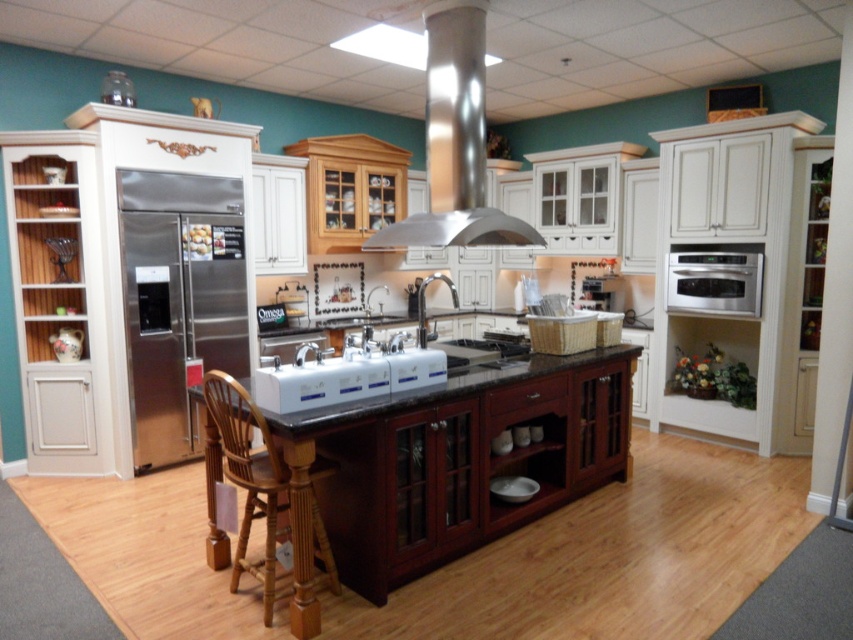
Based on the photo, which of these two, stainless steel refrigerator at left or stainless steel exhaust hood at center, stands taller?

stainless steel refrigerator at left

Does stainless steel refrigerator at left appear on the right side of stainless steel exhaust hood at center?

No, stainless steel refrigerator at left is not to the right of stainless steel exhaust hood at center.

Does point (166, 180) come in front of point (386, 230)?

No.

At what (x,y) coordinates should I click in order to perform the action: click on stainless steel refrigerator at left. Please return your answer as a coordinate pair (x, y). Looking at the image, I should click on (178, 300).

Is dark brown granite at center thinner than stainless steel refrigerator at left?

No.

Does dark brown granite at center appear over stainless steel refrigerator at left?

Incorrect, dark brown granite at center is not positioned above stainless steel refrigerator at left.

Which is in front, point (492, 435) or point (151, 204)?

Point (492, 435) is in front.

Find the location of `dark brown granite at center`. dark brown granite at center is located at coordinates (447, 464).

Between point (546, 372) and point (403, 387), which one is positioned behind?

Positioned behind is point (546, 372).

Who is shorter, dark brown granite at center or white glossy sink at center?

white glossy sink at center is shorter.

The width and height of the screenshot is (853, 640). Find the location of `dark brown granite at center`. dark brown granite at center is located at coordinates (447, 464).